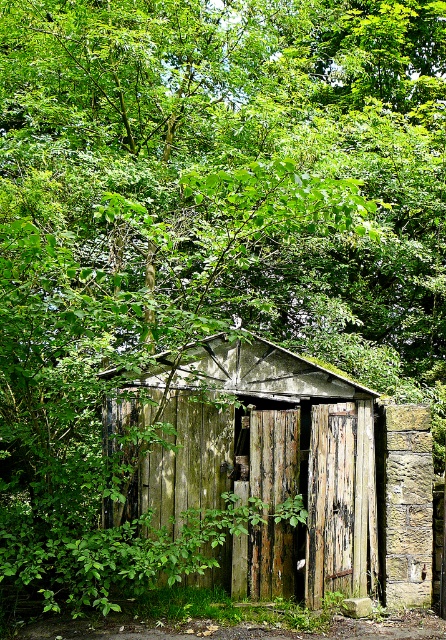
You are standing in front of the weathered wood door at center and want to enter the weathered wood hut at center. In which direction should you move relative to the door?

The weathered wood hut at center is to the right of the weathered wood door at center, so you should move to the right relative to the door to enter the hut.

You are standing in front of the rustic wooden shed and want to enter through the peeling wood door at center. Based on the coordinates provided, can you determine the exact position of the door relative to your current location?

The peeling wood door at center is located at coordinates point [330,500], which means it is positioned at the center of the shed, making it easily accessible from your current position in front of the shed.

You are trying to enter the weathered wood hut at center. The weathered wood door at center is the only entrance. Can you walk through the door without bending down?

The weathered wood door at center is narrower than the weathered wood hut at center, so you can walk through the door without bending down.